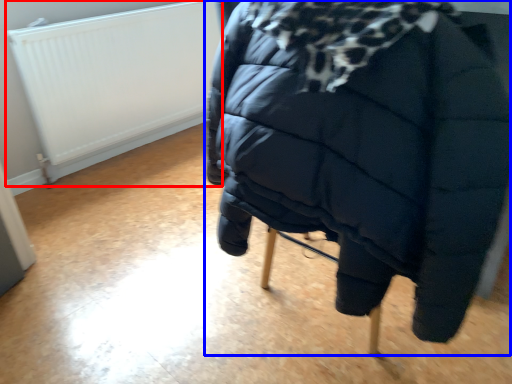
Question: Which object appears closest to the camera in this image, radiator (highlighted by a red box) or furniture (highlighted by a blue box)?

Choices:
 (A) radiator
 (B) furniture

Answer: (B)